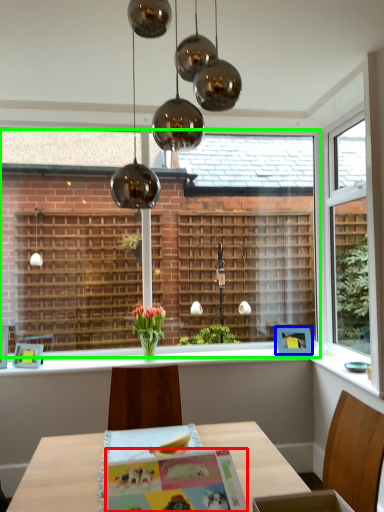
Question: Estimate the real-world distances between objects in this image. Which object is farther from postcard (highlighted by a red box), picture frame (highlighted by a blue box) or bay window (highlighted by a green box)?

Choices:
 (A) picture frame
 (B) bay window

Answer: (B)